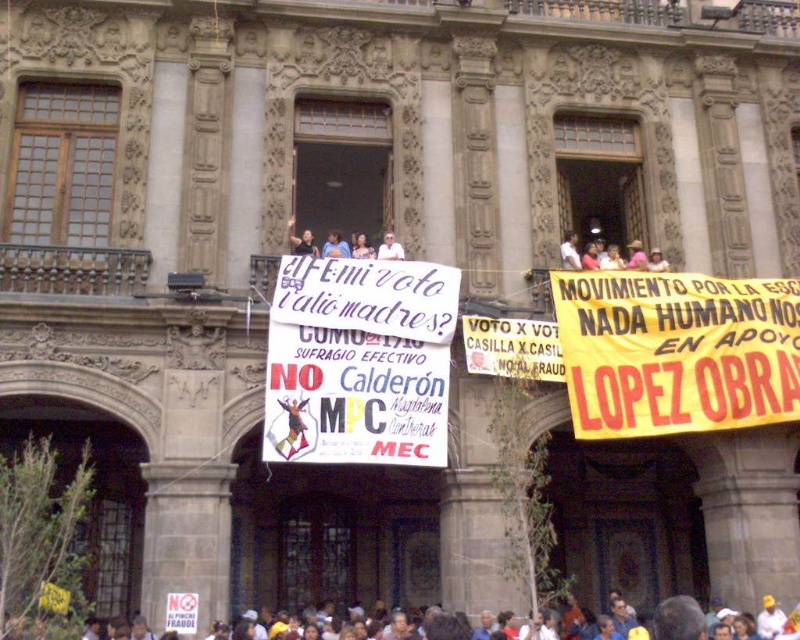
Question: Is yellow fabric banner at upper right smaller than white paper sign at center?

Choices:
 (A) no
 (B) yes

Answer: (A)

Question: Among these points, which one is farthest from the camera?

Choices:
 (A) (466, 634)
 (B) (366, 371)
 (C) (304, 234)

Answer: (C)

Question: Can you confirm if white paper sign at center is wider than multicolored fabric crowd at lower center?

Choices:
 (A) yes
 (B) no

Answer: (B)

Question: Can you confirm if dark blue shirt at center is positioned above light skin tone shirt at center?

Choices:
 (A) no
 (B) yes

Answer: (B)

Question: Which is farther from the dark blue shirt at center?

Choices:
 (A) white fabric at upper center
 (B) white paper sign at center

Answer: (A)

Question: Which point is farther from the camera taking this photo?

Choices:
 (A) (384, 257)
 (B) (241, 637)
 (C) (300, 236)

Answer: (C)